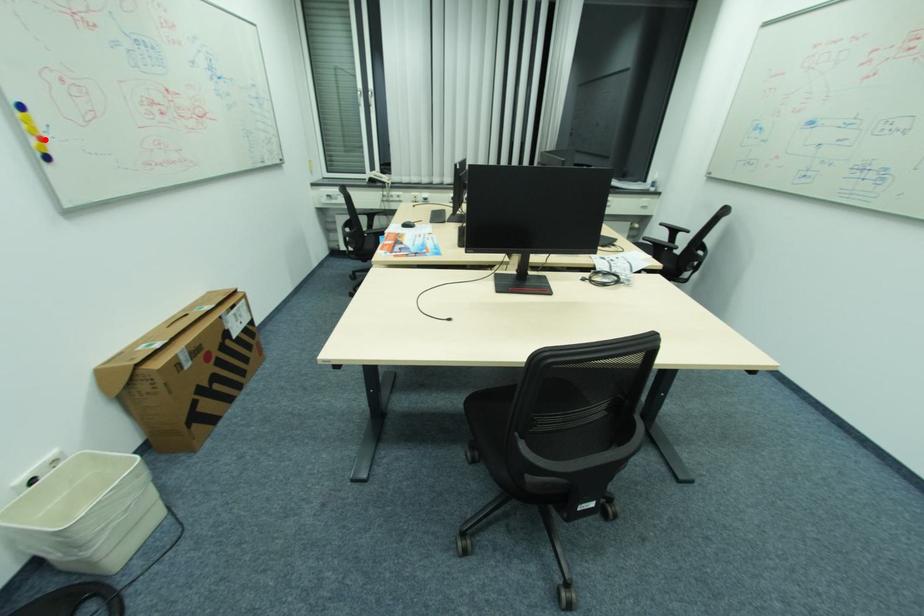
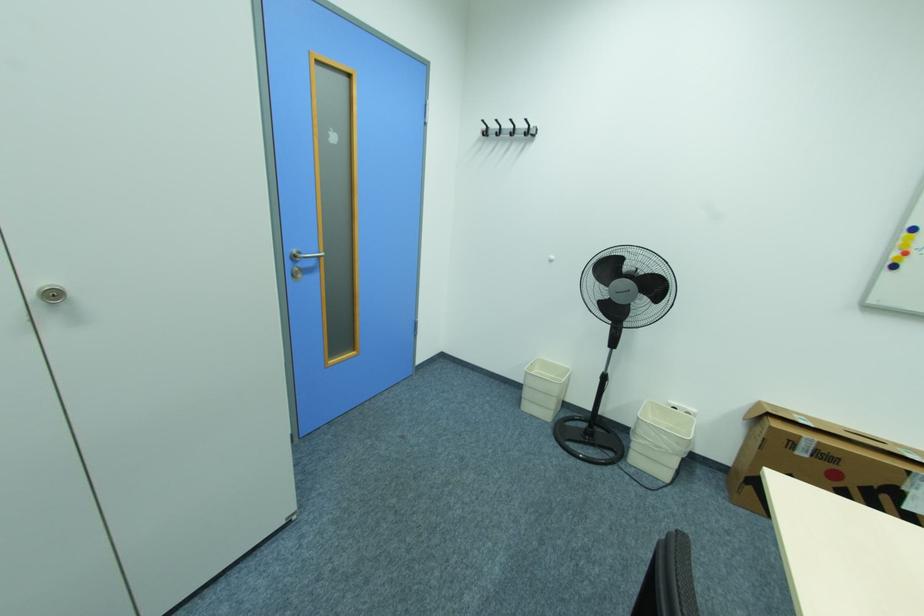
Where in the second image is the point corresponding to the highlighted location from the first image?

(910, 253)